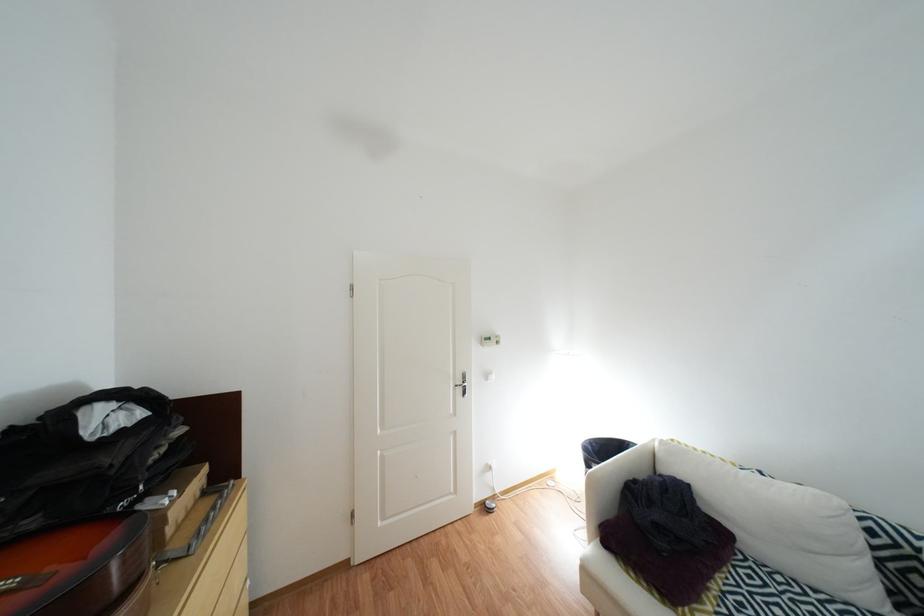
Find where to pull the silver door handle. Please return your answer as a coordinate pair (x, y).

(464, 389)